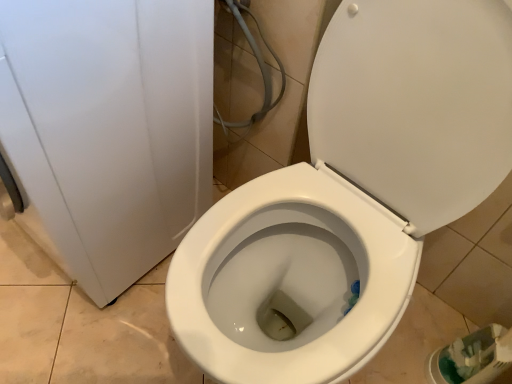
Question: Considering the positions of white glossy toilet at center and white glossy toilet at center in the image, is white glossy toilet at center bigger or smaller than white glossy toilet at center?

Choices:
 (A) big
 (B) small

Answer: (B)

Question: From the image's perspective, is white glossy toilet at center located above or below white glossy toilet at center?

Choices:
 (A) above
 (B) below

Answer: (B)

Question: Looking at their shapes, would you say white glossy toilet at center is wider or thinner than white glossy toilet at center?

Choices:
 (A) wide
 (B) thin

Answer: (A)

Question: In the image, is white glossy toilet at center positioned in front of or behind white glossy toilet at center?

Choices:
 (A) behind
 (B) front

Answer: (A)

Question: Does point (162, 56) appear closer or farther from the camera than point (308, 329)?

Choices:
 (A) closer
 (B) farther

Answer: (A)

Question: Is white glossy toilet at center situated inside white glossy toilet at center or outside?

Choices:
 (A) inside
 (B) outside

Answer: (B)

Question: In terms of width, does white glossy toilet at center look wider or thinner when compared to white glossy toilet at center?

Choices:
 (A) wide
 (B) thin

Answer: (B)